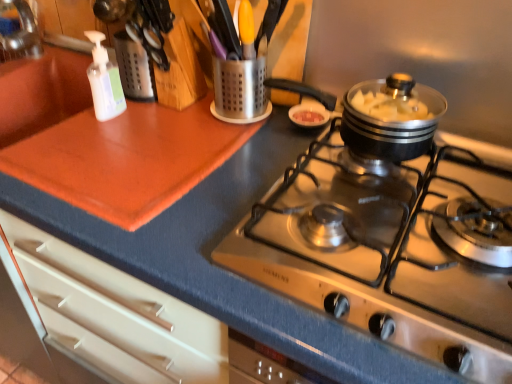
The image size is (512, 384). In order to click on free space to the left of stainless steel cooktop at center in this screenshot , I will do `click(170, 188)`.